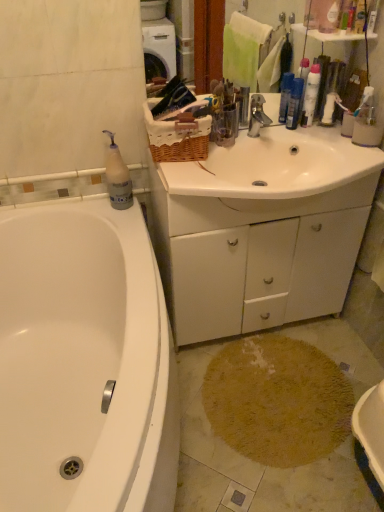
Question: Is white glossy sink at center turned away from white matte cabinet at center?

Choices:
 (A) no
 (B) yes

Answer: (B)

Question: Is white glossy sink at center wider than white matte cabinet at center?

Choices:
 (A) no
 (B) yes

Answer: (B)

Question: From a real-world perspective, is white glossy sink at center positioned under white matte cabinet at center based on gravity?

Choices:
 (A) yes
 (B) no

Answer: (B)

Question: Is white glossy sink at center in front of white matte cabinet at center?

Choices:
 (A) yes
 (B) no

Answer: (A)

Question: Does white glossy sink at center have a larger size compared to white matte cabinet at center?

Choices:
 (A) no
 (B) yes

Answer: (A)

Question: From a real-world perspective, relative to metallic silver faucet at center, is translucent plastic bottle at upper left, arranged as the second cleaning product when viewed from the top, vertically above or below?

Choices:
 (A) below
 (B) above

Answer: (A)

Question: Considering the positions of translucent plastic bottle at upper left, marked as the 2th cleaning product in a right-to-left arrangement, and metallic silver faucet at center in the image, is translucent plastic bottle at upper left, marked as the 2th cleaning product in a right-to-left arrangement, bigger or smaller than metallic silver faucet at center?

Choices:
 (A) small
 (B) big

Answer: (B)

Question: Looking at their shapes, would you say translucent plastic bottle at upper left, marked as the 2th cleaning product in a right-to-left arrangement, is wider or thinner than metallic silver faucet at center?

Choices:
 (A) thin
 (B) wide

Answer: (A)

Question: From the image's perspective, relative to metallic silver faucet at center, is translucent plastic bottle at upper left, the first cleaning product from the left, above or below?

Choices:
 (A) below
 (B) above

Answer: (A)

Question: Considering the positions of white matte cabinet at center and white glossy sink at center in the image, is white matte cabinet at center wider or thinner than white glossy sink at center?

Choices:
 (A) wide
 (B) thin

Answer: (B)

Question: Is white matte cabinet at center bigger or smaller than white glossy sink at center?

Choices:
 (A) small
 (B) big

Answer: (B)

Question: In terms of height, does white matte cabinet at center look taller or shorter compared to white glossy sink at center?

Choices:
 (A) tall
 (B) short

Answer: (A)

Question: Considering the positions of point (326, 161) and point (286, 134), is point (326, 161) closer or farther from the camera than point (286, 134)?

Choices:
 (A) farther
 (B) closer

Answer: (B)

Question: From the image's perspective, relative to white matte cabinet at center, is beige shaggy rug at lower center above or below?

Choices:
 (A) above
 (B) below

Answer: (B)

Question: From their relative heights in the image, would you say beige shaggy rug at lower center is taller or shorter than white matte cabinet at center?

Choices:
 (A) short
 (B) tall

Answer: (A)